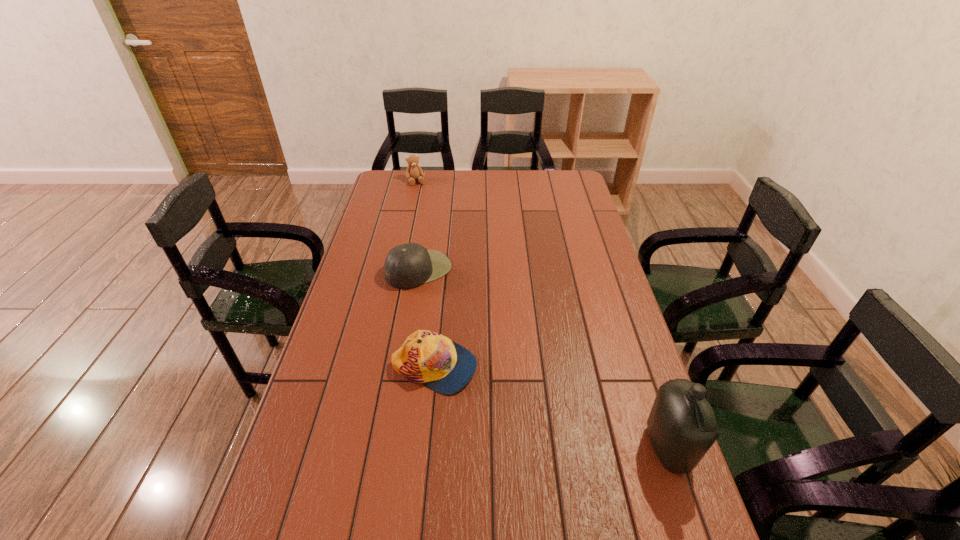
Locate an element on the screen. The width and height of the screenshot is (960, 540). free spot on the desktop that is between the second nearest object and the nearest object and is positioned on the brim of the third nearest object is located at coordinates (554, 409).

Identify the location of free space on the desktop that is between the third farthest object and the bottle and is positioned on the front-facing side of the teddy bear. (515, 395).